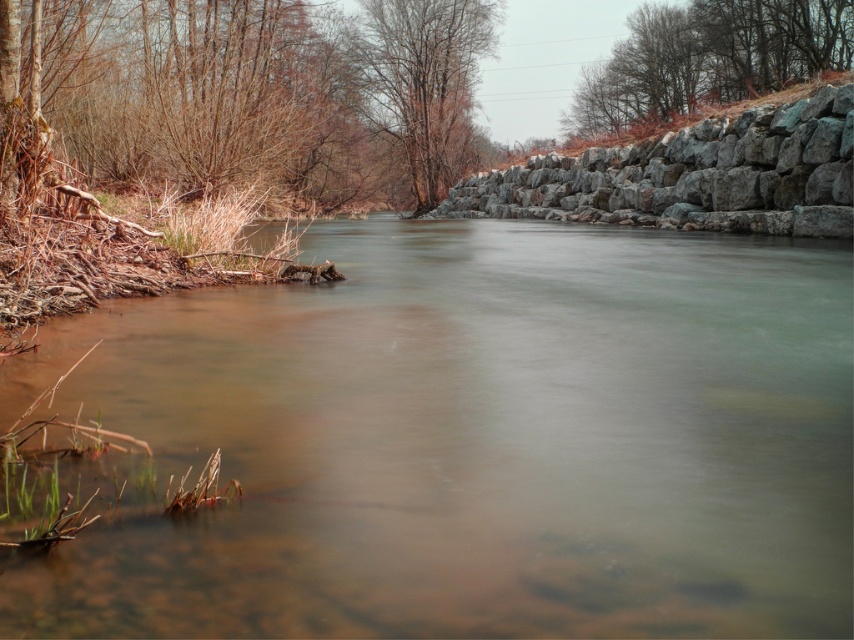
Does point (676, 12) lie in front of point (366, 100)?

Yes, it is.

Describe the element at coordinates (708, 58) in the screenshot. The height and width of the screenshot is (640, 854). I see `brown textured rock at upper right` at that location.

Between point (671, 83) and point (370, 76), which one is positioned behind?

Point (370, 76)

What are the coordinates of `brown textured rock at upper right` in the screenshot? It's located at (708, 58).

Which is below, clear water at center or gray rock wall at right?

clear water at center

Describe the element at coordinates (475, 442) in the screenshot. I see `clear water at center` at that location.

Is point (150, 627) behind point (592, 195)?

No, (150, 627) is in front of (592, 195).

At what (x,y) coordinates should I click in order to perform the action: click on clear water at center. Please return your answer as a coordinate pair (x, y). Looking at the image, I should click on (475, 442).

Does clear water at center appear over bare wood tree at upper center?

Incorrect, clear water at center is not positioned above bare wood tree at upper center.

Does point (662, 380) lie behind point (436, 141)?

No.

Describe the element at coordinates (475, 442) in the screenshot. I see `clear water at center` at that location.

Image resolution: width=854 pixels, height=640 pixels. What are the coordinates of `clear water at center` in the screenshot? It's located at (475, 442).